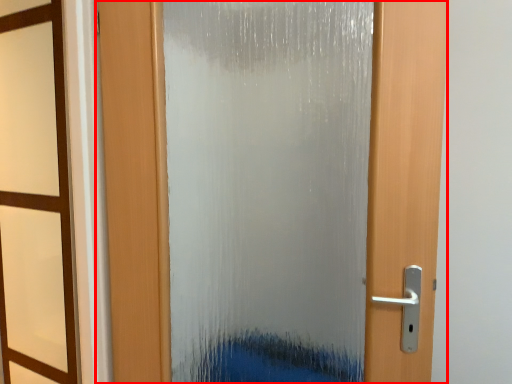
Question: In this image, where is door (annotated by the red box) located relative to window frame?

Choices:
 (A) right
 (B) left

Answer: (A)